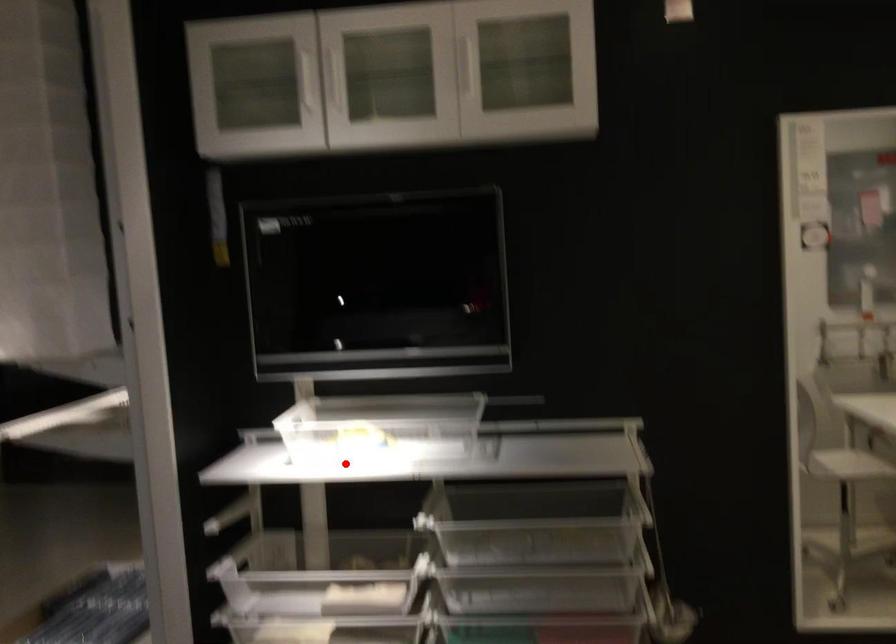
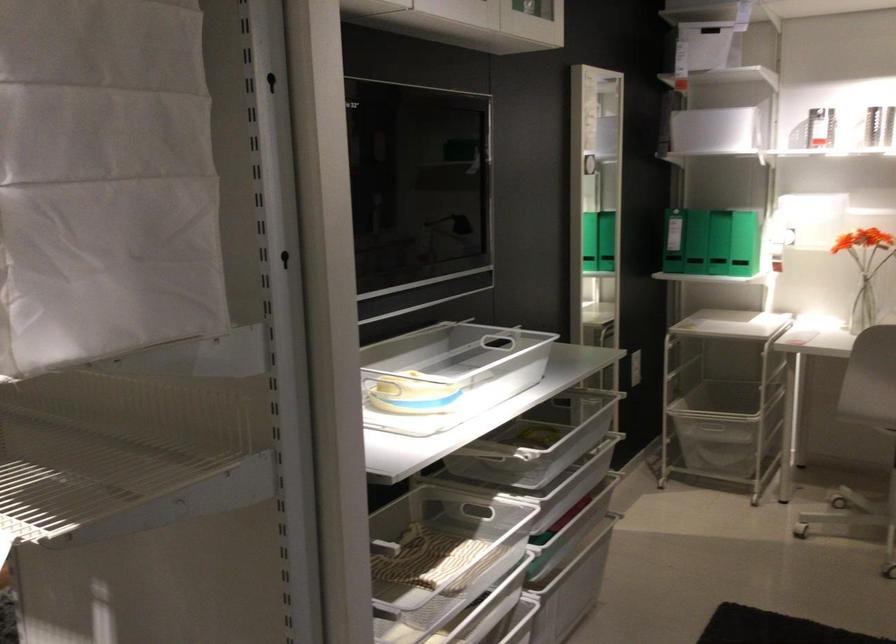
Find the pixel in the second image that matches the highlighted location in the first image.

(409, 392)